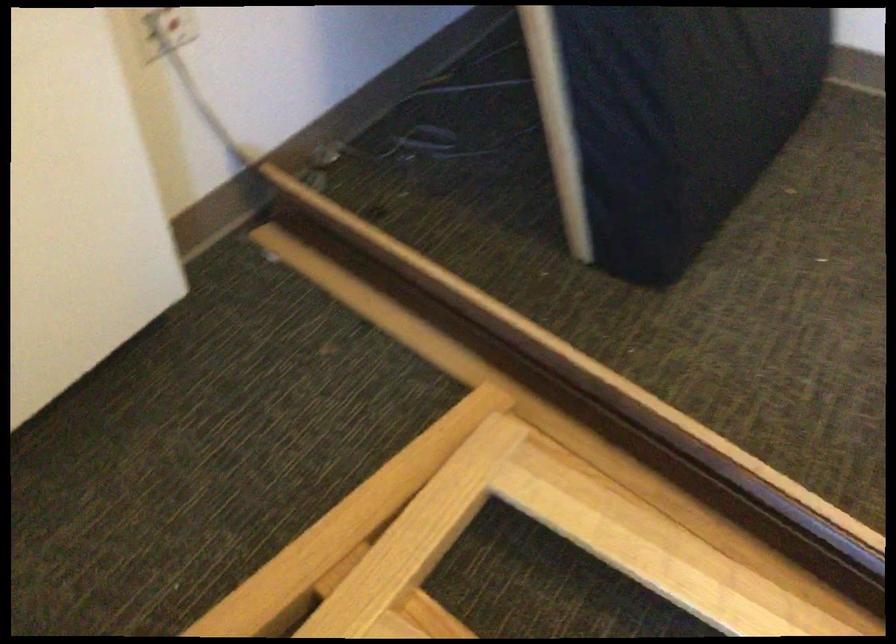
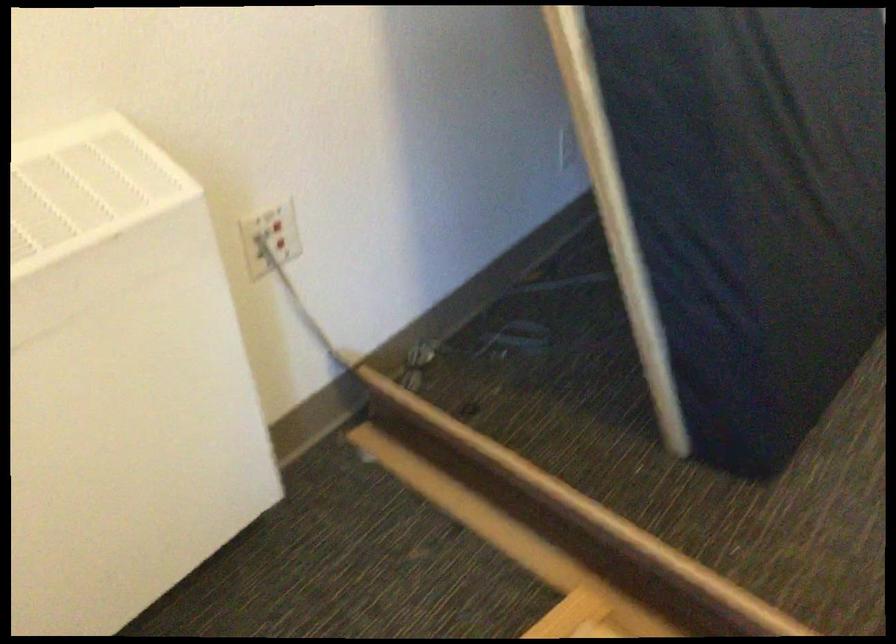
The images are taken continuously from a first-person perspective. In which direction are you moving?

The cameraman moved toward right, backward.